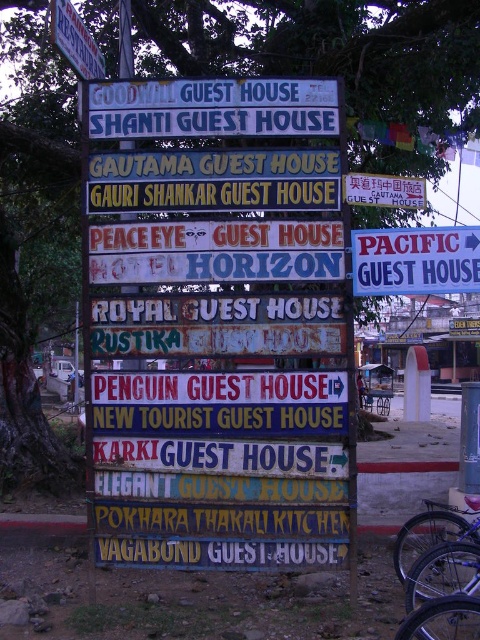
Question: In this image, where is white painted wood sign at upper center located relative to white plastic sign at right?

Choices:
 (A) right
 (B) left

Answer: (B)

Question: Can you confirm if white plastic sign at right is thinner than brushed metal sign at upper left?

Choices:
 (A) yes
 (B) no

Answer: (B)

Question: Based on their relative distances, which object is farther from the brushed metal sign at upper left?

Choices:
 (A) white plastic sign at right
 (B) white painted wood sign at upper center

Answer: (A)

Question: Is white painted wood sign at upper center positioned before brushed metal sign at upper left?

Choices:
 (A) yes
 (B) no

Answer: (B)

Question: Which object is positioned closest to the white plastic sign at right?

Choices:
 (A) brushed metal sign at upper left
 (B) white painted wood sign at upper center

Answer: (B)

Question: Which of the following is the closest to the observer?

Choices:
 (A) white painted wood sign at upper center
 (B) white plastic sign at right

Answer: (B)